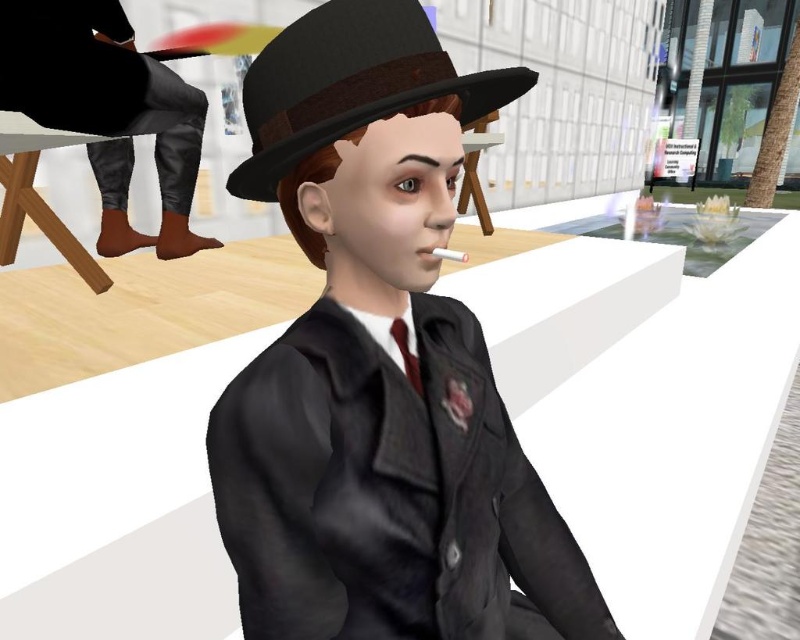
Question: Which of these objects is positioned farthest from the matte brown fedora at center?

Choices:
 (A) leather pants at left
 (B) matte black suit at center
 (C) dark red satin tie at center

Answer: (A)

Question: Is matte black suit at center smaller than dark red satin tie at center?

Choices:
 (A) no
 (B) yes

Answer: (A)

Question: Which object appears closest to the camera in this image?

Choices:
 (A) matte brown fedora at center
 (B) matte black suit at center
 (C) dark red satin tie at center
 (D) leather pants at left

Answer: (A)

Question: Is matte black suit at center to the left of dark red satin tie at center from the viewer's perspective?

Choices:
 (A) yes
 (B) no

Answer: (A)

Question: Which object appears farthest from the camera in this image?

Choices:
 (A) leather pants at left
 (B) matte brown fedora at center

Answer: (A)

Question: Can you confirm if matte black suit at center is thinner than dark red satin tie at center?

Choices:
 (A) no
 (B) yes

Answer: (A)